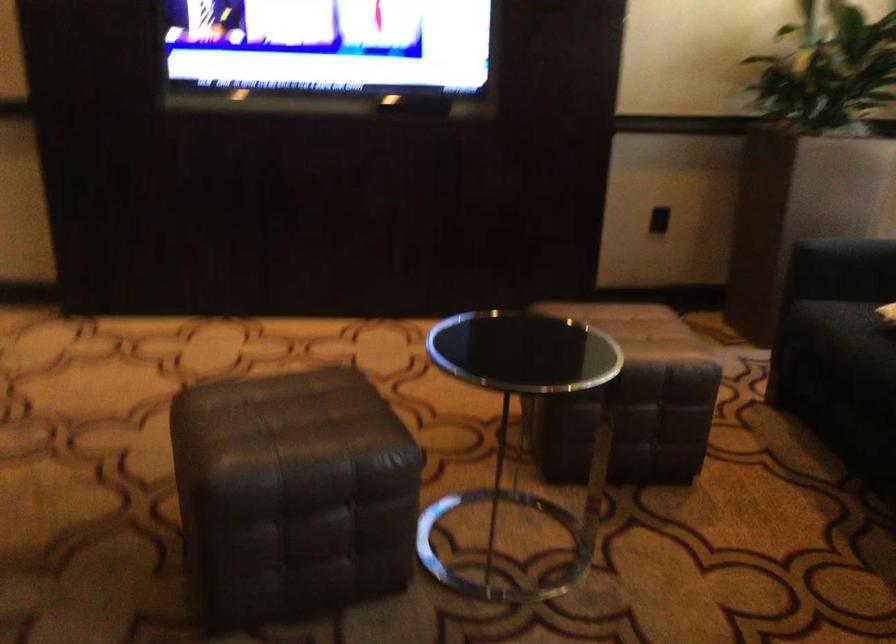
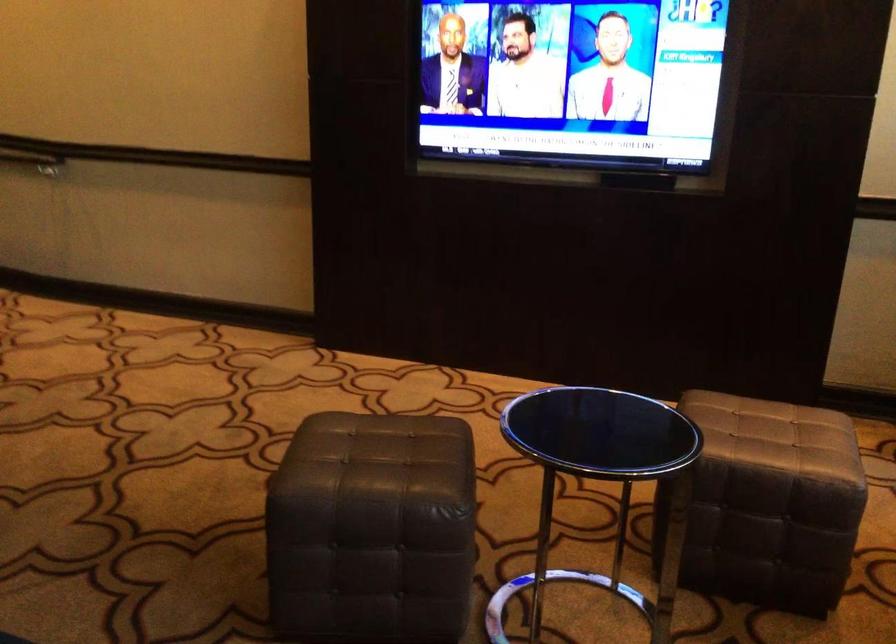
Question: The camera is either moving clockwise (left) or counter-clockwise (right) around the object. The first image is from the beginning of the video and the second image is from the end. Is the camera moving left or right when shooting the video?

Choices:
 (A) Left
 (B) Right

Answer: (B)